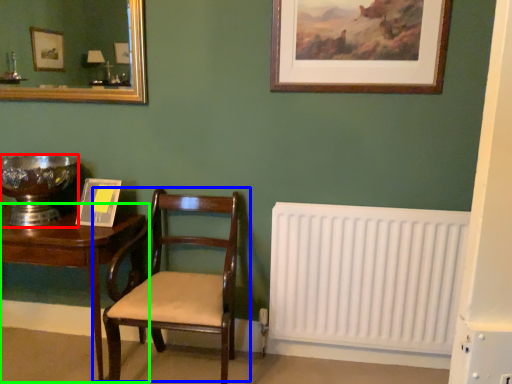
Question: Based on their relative distances, which object is farther from glass bowl (highlighted by a red box)? Choose from chair (highlighted by a blue box) and table (highlighted by a green box).

Choices:
 (A) chair
 (B) table

Answer: (A)